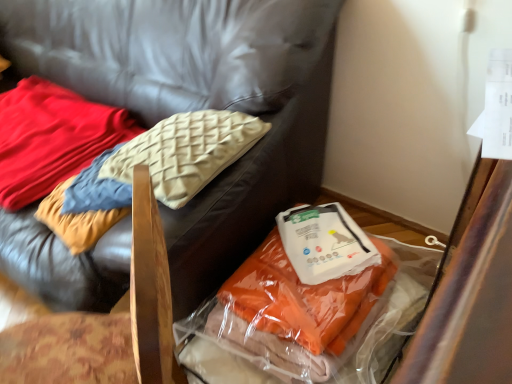
Where is `translucent plastic bag at lower right, which is the 1th furniture from left to right`? translucent plastic bag at lower right, which is the 1th furniture from left to right is located at coordinates (199, 102).

Describe the element at coordinates (307, 316) in the screenshot. I see `orange fabric at lower right` at that location.

At what (x,y) coordinates should I click in order to perform the action: click on white plastic kit at lower right. Please return your answer as a coordinate pair (x, y). This screenshot has height=384, width=512. Looking at the image, I should click on (325, 243).

The width and height of the screenshot is (512, 384). In order to click on velvet cushion at upper left, the 2th furniture viewed from the left in this screenshot , I will do `click(106, 323)`.

How different are the orientations of translucent plastic bag at lower right, which is the 1th furniture from left to right, and velvet cushion at upper left, the 2th furniture viewed from the left, in degrees?

The angular difference between translucent plastic bag at lower right, which is the 1th furniture from left to right, and velvet cushion at upper left, the 2th furniture viewed from the left, is 36.8 degrees.

Considering the relative positions of translucent plastic bag at lower right, which is the 1th furniture from left to right, and velvet cushion at upper left, which is the 1th furniture from right to left, in the image provided, is translucent plastic bag at lower right, which is the 1th furniture from left to right, to the right of velvet cushion at upper left, which is the 1th furniture from right to left, from the viewer's perspective?

Incorrect, translucent plastic bag at lower right, which is the 1th furniture from left to right, is not on the right side of velvet cushion at upper left, which is the 1th furniture from right to left.

Is velvet cushion at upper left, which is the 1th furniture from right to left, at the back of translucent plastic bag at lower right, which is the 1th furniture from left to right?

No, velvet cushion at upper left, which is the 1th furniture from right to left, is not at the back of translucent plastic bag at lower right, which is the 1th furniture from left to right.

Is translucent plastic bag at lower right, which is the 1th furniture from left to right, not inside velvet cushion at upper left, the 2th furniture viewed from the left?

Yes, translucent plastic bag at lower right, which is the 1th furniture from left to right, is located beyond the bounds of velvet cushion at upper left, the 2th furniture viewed from the left.

From a real-world perspective, who is located lower, white plastic kit at lower right or velvet cushion at upper left, which is the 1th furniture from right to left?

white plastic kit at lower right.

Which of these two, white plastic kit at lower right or velvet cushion at upper left, which is the 1th furniture from right to left, is wider?

With larger width is velvet cushion at upper left, which is the 1th furniture from right to left.

Who is smaller, white plastic kit at lower right or velvet cushion at upper left, the 2th furniture viewed from the left?

white plastic kit at lower right.

Is white plastic kit at lower right spatially inside velvet cushion at upper left, the 2th furniture viewed from the left, or outside of it?

white plastic kit at lower right is not inside velvet cushion at upper left, the 2th furniture viewed from the left, it's outside.

Can you confirm if soft cream pillow at upper left is positioned to the left of white plastic kit at lower right?

Indeed, soft cream pillow at upper left is positioned on the left side of white plastic kit at lower right.

Looking at their sizes, would you say soft cream pillow at upper left is wider or thinner than white plastic kit at lower right?

In the image, soft cream pillow at upper left appears to be wider than white plastic kit at lower right.

Is soft cream pillow at upper left located outside white plastic kit at lower right?

soft cream pillow at upper left lies outside white plastic kit at lower right's area.

Between soft cream pillow at upper left and white plastic kit at lower right, which one has smaller size?

With smaller size is white plastic kit at lower right.

What's the angular difference between translucent plastic bag at lower right, which is the 1th furniture from left to right, and white plastic kit at lower right's facing directions?

The facing directions of translucent plastic bag at lower right, which is the 1th furniture from left to right, and white plastic kit at lower right are 39.6 degrees apart.

From the image's perspective, is translucent plastic bag at lower right, the 2th furniture when ordered from right to left, located above or below white plastic kit at lower right?

Clearly, from the image's perspective, translucent plastic bag at lower right, the 2th furniture when ordered from right to left, is above white plastic kit at lower right.

You are a GUI agent. You are given a task and a screenshot of the screen. Output one action in this format:
    pyautogui.click(x=<x>, y=<y>)
    Task: Click on the kit located behind the translucent plastic bag at lower right, the 2th furniture when ordered from right to left
    The image size is (512, 384).
    Given the screenshot: What is the action you would take?
    pyautogui.click(x=325, y=243)

Can you confirm if translucent plastic bag at lower right, which is the 1th furniture from left to right, is positioned to the left of white plastic kit at lower right?

Correct, you'll find translucent plastic bag at lower right, which is the 1th furniture from left to right, to the left of white plastic kit at lower right.

From the image's perspective, is orange fabric at lower right beneath white plastic kit at lower right?

Indeed, from the image's perspective, orange fabric at lower right is shown beneath white plastic kit at lower right.

From the picture: Which object is positioned more to the left, orange fabric at lower right or white plastic kit at lower right?

orange fabric at lower right.

Based on the photo, looking at their sizes, would you say orange fabric at lower right is wider or thinner than white plastic kit at lower right?

orange fabric at lower right is wider than white plastic kit at lower right.

Is translucent plastic bag at lower right, which is the 1th furniture from left to right, beside soft cream pillow at upper left?

No, translucent plastic bag at lower right, which is the 1th furniture from left to right, is not with soft cream pillow at upper left.

Which is more to the left, translucent plastic bag at lower right, the 2th furniture when ordered from right to left, or soft cream pillow at upper left?

Positioned to the left is soft cream pillow at upper left.

Is translucent plastic bag at lower right, which is the 1th furniture from left to right, facing away from soft cream pillow at upper left?

Correct, translucent plastic bag at lower right, which is the 1th furniture from left to right, is looking away from soft cream pillow at upper left.

Can you tell me how much translucent plastic bag at lower right, which is the 1th furniture from left to right, and soft cream pillow at upper left differ in facing direction?

The angle between the facing direction of translucent plastic bag at lower right, which is the 1th furniture from left to right, and the facing direction of soft cream pillow at upper left is 2.83 degrees.

Based on the photo, is the depth of white plastic kit at lower right greater than that of orange fabric at lower right?

Yes, white plastic kit at lower right is further from the camera.

Can you tell me how much white plastic kit at lower right and orange fabric at lower right differ in facing direction?

There is a 41.2-degree angle between the facing directions of white plastic kit at lower right and orange fabric at lower right.

Are white plastic kit at lower right and orange fabric at lower right located far from each other?

No, white plastic kit at lower right is in close proximity to orange fabric at lower right.

Identify the location of furniture located on the right of translucent plastic bag at lower right, which is the 1th furniture from left to right. Image resolution: width=512 pixels, height=384 pixels. (106, 323).

At what (x,y) coordinates should I click in order to perform the action: click on furniture below the white plastic kit at lower right (from the image's perspective). Please return your answer as a coordinate pair (x, y). The image size is (512, 384). Looking at the image, I should click on (106, 323).

Consider the image. When comparing their distances from white plastic kit at lower right, does translucent plastic bag at lower right, the 2th furniture when ordered from right to left, or orange fabric at lower right seem further?

translucent plastic bag at lower right, the 2th furniture when ordered from right to left.

Estimate the real-world distances between objects in this image. Which object is closer to velvet cushion at upper left, the 2th furniture viewed from the left, soft cream pillow at upper left or orange fabric at lower right?

Based on the image, orange fabric at lower right appears to be nearer to velvet cushion at upper left, the 2th furniture viewed from the left.

Looking at the image, which one is located closer to white plastic kit at lower right, soft cream pillow at upper left or translucent plastic bag at lower right, which is the 1th furniture from left to right?

translucent plastic bag at lower right, which is the 1th furniture from left to right, lies closer to white plastic kit at lower right than the other object.

Based on their spatial positions, is white plastic kit at lower right or orange fabric at lower right closer to velvet cushion at upper left, which is the 1th furniture from right to left?

The object closer to velvet cushion at upper left, which is the 1th furniture from right to left, is orange fabric at lower right.

Looking at the image, which one is located further to velvet cushion at upper left, the 2th furniture viewed from the left, soft cream pillow at upper left or translucent plastic bag at lower right, which is the 1th furniture from left to right?

soft cream pillow at upper left is further to velvet cushion at upper left, the 2th furniture viewed from the left.

From the image, which object appears to be farther from white plastic kit at lower right, orange fabric at lower right or translucent plastic bag at lower right, which is the 1th furniture from left to right?

translucent plastic bag at lower right, which is the 1th furniture from left to right, is further to white plastic kit at lower right.

When comparing their distances from velvet cushion at upper left, the 2th furniture viewed from the left, does translucent plastic bag at lower right, which is the 1th furniture from left to right, or orange fabric at lower right seem further?

translucent plastic bag at lower right, which is the 1th furniture from left to right.

Which object lies nearer to the anchor point translucent plastic bag at lower right, the 2th furniture when ordered from right to left, orange fabric at lower right or velvet cushion at upper left, which is the 1th furniture from right to left?

orange fabric at lower right lies closer to translucent plastic bag at lower right, the 2th furniture when ordered from right to left, than the other object.

At what (x,y) coordinates should I click in order to perform the action: click on waste between velvet cushion at upper left, the 2th furniture viewed from the left, and white plastic kit at lower right from front to back. Please return your answer as a coordinate pair (x, y). This screenshot has height=384, width=512. Looking at the image, I should click on (307, 316).

This screenshot has width=512, height=384. In order to click on waste between translucent plastic bag at lower right, which is the 1th furniture from left to right, and white plastic kit at lower right from left to right in this screenshot , I will do `click(307, 316)`.

This screenshot has width=512, height=384. What are the coordinates of `furniture between translucent plastic bag at lower right, the 2th furniture when ordered from right to left, and orange fabric at lower right, in the horizontal direction` in the screenshot? It's located at (106, 323).

What are the coordinates of `furniture between translucent plastic bag at lower right, which is the 1th furniture from left to right, and white plastic kit at lower right from left to right` in the screenshot? It's located at (106, 323).